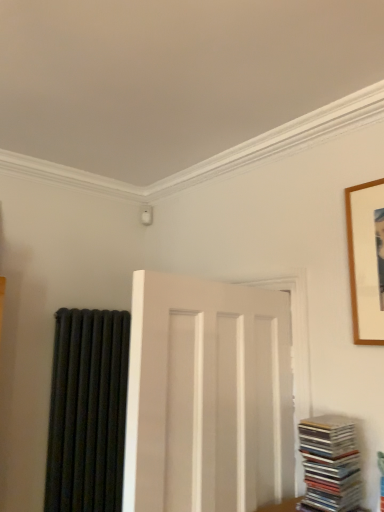
Image resolution: width=384 pixels, height=512 pixels. What do you see at coordinates (366, 260) in the screenshot?
I see `wooden picture frame at upper right` at bounding box center [366, 260].

Locate an element on the screen. The width and height of the screenshot is (384, 512). wooden picture frame at upper right is located at coordinates (366, 260).

Does stacked glossy cds at lower right have a smaller size compared to wooden picture frame at upper right?

No.

Does stacked glossy cds at lower right have a lesser width compared to wooden picture frame at upper right?

No.

Which object is positioned more to the right, stacked glossy cds at lower right or wooden picture frame at upper right?

From the viewer's perspective, wooden picture frame at upper right appears more on the right side.

From the image's perspective, is black matte radiator at left beneath wooden picture frame at upper right?

Correct, black matte radiator at left appears lower than wooden picture frame at upper right in the image.

Which is behind, point (108, 437) or point (356, 331)?

Positioned behind is point (108, 437).

Visually, is black matte radiator at left positioned to the left or to the right of wooden picture frame at upper right?

black matte radiator at left is to the left of wooden picture frame at upper right.

Is black matte radiator at left surrounding wooden picture frame at upper right?

No, wooden picture frame at upper right is not surrounded by black matte radiator at left.

Measure the distance between wooden picture frame at upper right and black matte radiator at left.

wooden picture frame at upper right is 4.52 feet from black matte radiator at left.

From a real-world perspective, between wooden picture frame at upper right and black matte radiator at left, who is vertically lower?

black matte radiator at left is physically lower.

Does wooden picture frame at upper right have a lesser width compared to black matte radiator at left?

Yes, wooden picture frame at upper right is thinner than black matte radiator at left.

Considering the relative positions of wooden picture frame at upper right and black matte radiator at left in the image provided, is wooden picture frame at upper right in front of black matte radiator at left?

Yes, the depth of wooden picture frame at upper right is less than that of black matte radiator at left.

Who is bigger, stacked glossy cds at lower right or black matte radiator at left?

With larger size is black matte radiator at left.

From the image's perspective, relative to black matte radiator at left, is stacked glossy cds at lower right above or below?

From the image's perspective, stacked glossy cds at lower right appears above black matte radiator at left.

Is stacked glossy cds at lower right facing away from black matte radiator at left?

No, black matte radiator at left is not at the back of stacked glossy cds at lower right.

Is stacked glossy cds at lower right located outside black matte radiator at left?

Yes.

Between white matte door at center and black matte radiator at left, which one has smaller width?

black matte radiator at left.

Considering the positions of point (185, 449) and point (121, 362), is point (185, 449) closer or farther from the camera than point (121, 362)?

Point (185, 449) is closer to the camera than point (121, 362).

From a real-world perspective, which is physically above, white matte door at center or black matte radiator at left?

From a 3D spatial view, white matte door at center is above.

How different are the orientations of black matte radiator at left and white matte door at center in degrees?

The angular difference between black matte radiator at left and white matte door at center is 172 degrees.

Would you say black matte radiator at left contains white matte door at center?

No, white matte door at center is not a part of black matte radiator at left.

Is black matte radiator at left to the right of white matte door at center from the viewer's perspective?

No, black matte radiator at left is not to the right of white matte door at center.

Is black matte radiator at left aimed at white matte door at center?

Yes, black matte radiator at left is turned towards white matte door at center.

Between wooden picture frame at upper right and stacked glossy cds at lower right, which one is positioned behind?

wooden picture frame at upper right is further from the camera.

From the image's perspective, who appears lower, wooden picture frame at upper right or stacked glossy cds at lower right?

From the image's view, stacked glossy cds at lower right is below.

Can you confirm if wooden picture frame at upper right is positioned to the left of stacked glossy cds at lower right?

No, wooden picture frame at upper right is not to the left of stacked glossy cds at lower right.

Is wooden picture frame at upper right turned away from stacked glossy cds at lower right?

wooden picture frame at upper right does not have its back to stacked glossy cds at lower right.

This screenshot has height=512, width=384. In order to click on book on the left of wooden picture frame at upper right in this screenshot , I will do `click(330, 464)`.

Image resolution: width=384 pixels, height=512 pixels. I want to click on picture frame lying in front of the black matte radiator at left, so click(366, 260).

When comparing their distances from wooden picture frame at upper right, does stacked glossy cds at lower right or black matte radiator at left seem further?

The object further to wooden picture frame at upper right is black matte radiator at left.

Which object lies further to the anchor point stacked glossy cds at lower right, white matte door at center or wooden picture frame at upper right?

wooden picture frame at upper right is further to stacked glossy cds at lower right.

Which object lies further to the anchor point wooden picture frame at upper right, black matte radiator at left or stacked glossy cds at lower right?

black matte radiator at left is positioned further to the anchor wooden picture frame at upper right.

From the picture: From the image, which object appears to be farther from stacked glossy cds at lower right, wooden picture frame at upper right or black matte radiator at left?

black matte radiator at left is positioned further to the anchor stacked glossy cds at lower right.

In the scene shown: From the image, which object appears to be farther from black matte radiator at left, stacked glossy cds at lower right or wooden picture frame at upper right?

Among the two, wooden picture frame at upper right is located further to black matte radiator at left.

Based on their spatial positions, is stacked glossy cds at lower right or white matte door at center further from black matte radiator at left?

stacked glossy cds at lower right lies further to black matte radiator at left than the other object.

Which object lies nearer to the anchor point black matte radiator at left, wooden picture frame at upper right or white matte door at center?

white matte door at center is positioned closer to the anchor black matte radiator at left.

Which object lies further to the anchor point stacked glossy cds at lower right, black matte radiator at left or wooden picture frame at upper right?

Based on the image, black matte radiator at left appears to be further to stacked glossy cds at lower right.

Where is `door between black matte radiator at left and stacked glossy cds at lower right from left to right`? The image size is (384, 512). door between black matte radiator at left and stacked glossy cds at lower right from left to right is located at coordinates (207, 397).

Find the location of a particular element. This screenshot has width=384, height=512. book located between black matte radiator at left and wooden picture frame at upper right in the left-right direction is located at coordinates (330, 464).

The image size is (384, 512). Identify the location of door situated between black matte radiator at left and wooden picture frame at upper right from left to right. (207, 397).

The height and width of the screenshot is (512, 384). Find the location of `door that lies between wooden picture frame at upper right and stacked glossy cds at lower right from top to bottom`. door that lies between wooden picture frame at upper right and stacked glossy cds at lower right from top to bottom is located at coordinates (207, 397).